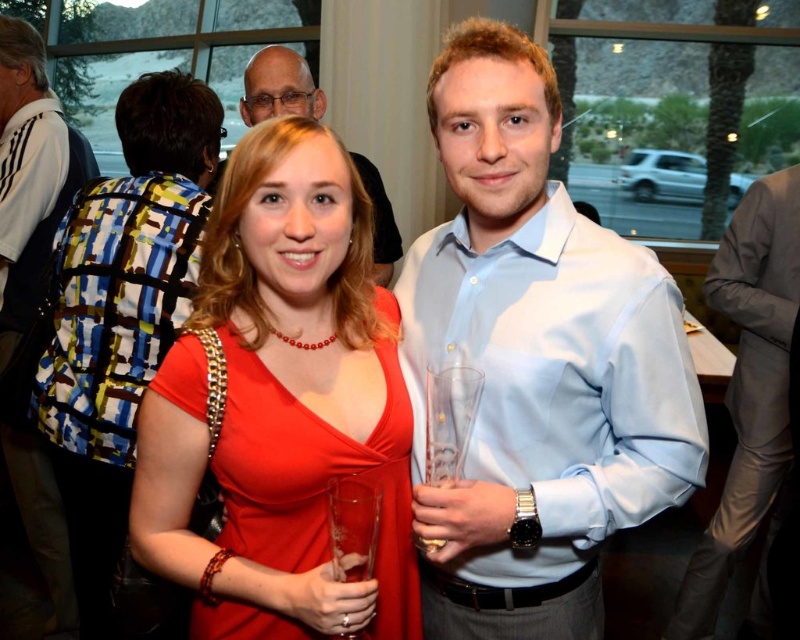
Is blue-and-white backpack at left below matte black glasses at upper center?

Yes, blue-and-white backpack at left is below matte black glasses at upper center.

Does blue-and-white backpack at left have a smaller size compared to matte black glasses at upper center?

Incorrect, blue-and-white backpack at left is not smaller in size than matte black glasses at upper center.

Find the location of a particular element. The width and height of the screenshot is (800, 640). blue-and-white backpack at left is located at coordinates (30, 173).

Does point (406, 358) lie behind point (58, 538)?

No, it is in front of (58, 538).

Which is more to the right, light blue shirt at center or blue-and-white backpack at left?

Positioned to the right is light blue shirt at center.

Locate an element on the screen. light blue shirt at center is located at coordinates (536, 362).

Does light blue shirt at center have a greater height compared to matte red dress at center?

Yes, light blue shirt at center is taller than matte red dress at center.

Can you confirm if light blue shirt at center is thinner than matte red dress at center?

No, light blue shirt at center is not thinner than matte red dress at center.

Which is in front, point (570, 372) or point (245, 625)?

Point (570, 372) is in front.

Where is `light blue shirt at center`? This screenshot has width=800, height=640. light blue shirt at center is located at coordinates (536, 362).